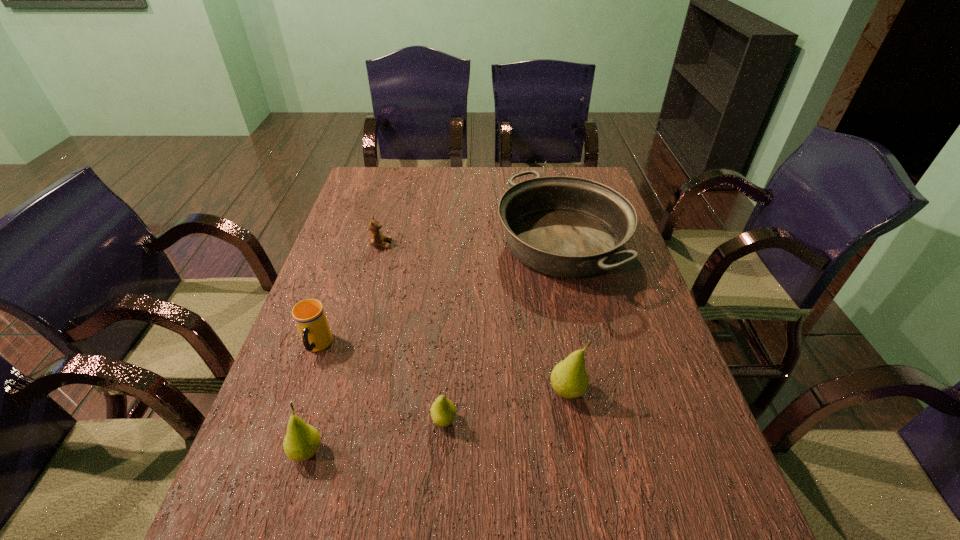
Identify the location of the nearest pear. The height and width of the screenshot is (540, 960). (301, 442).

At what (x,y) coordinates should I click in order to perform the action: click on the nearest object. Please return your answer as a coordinate pair (x, y). Image resolution: width=960 pixels, height=540 pixels. Looking at the image, I should click on (301, 442).

Find the location of a particular element. The height and width of the screenshot is (540, 960). the fifth farthest object is located at coordinates (443, 412).

This screenshot has height=540, width=960. Identify the location of the second pear from right to left. (443, 412).

In order to click on the farthest pear in this screenshot , I will do `click(569, 378)`.

At what (x,y) coordinates should I click in order to perform the action: click on the tallest object. Please return your answer as a coordinate pair (x, y). The image size is (960, 540). Looking at the image, I should click on (569, 378).

Find the location of `teddy bear`. teddy bear is located at coordinates (376, 237).

The image size is (960, 540). Identify the location of pan. (562, 226).

Where is `cup`? Image resolution: width=960 pixels, height=540 pixels. cup is located at coordinates (309, 315).

Locate an element on the screen. Image resolution: width=960 pixels, height=540 pixels. free spot located 0.310m on the back of the second shortest pear is located at coordinates (347, 322).